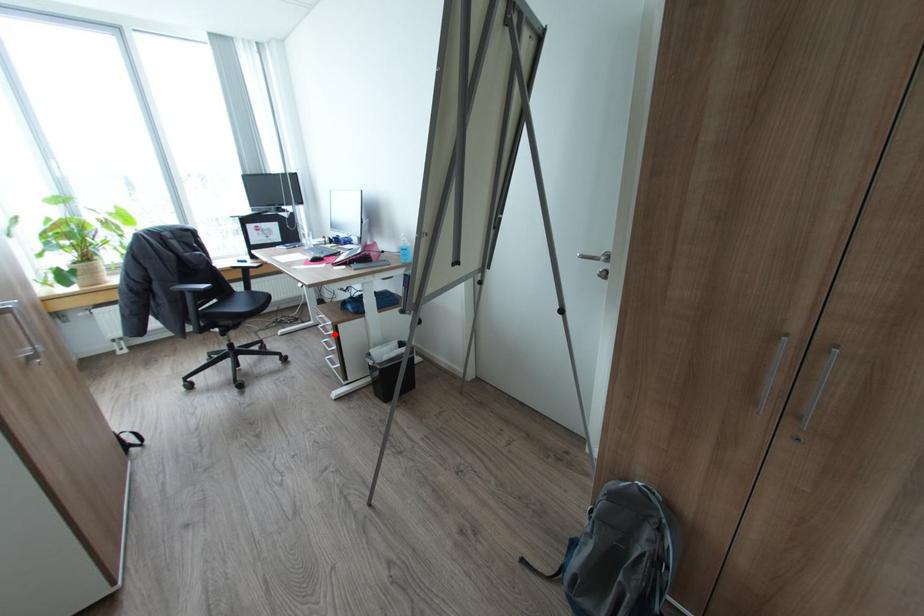
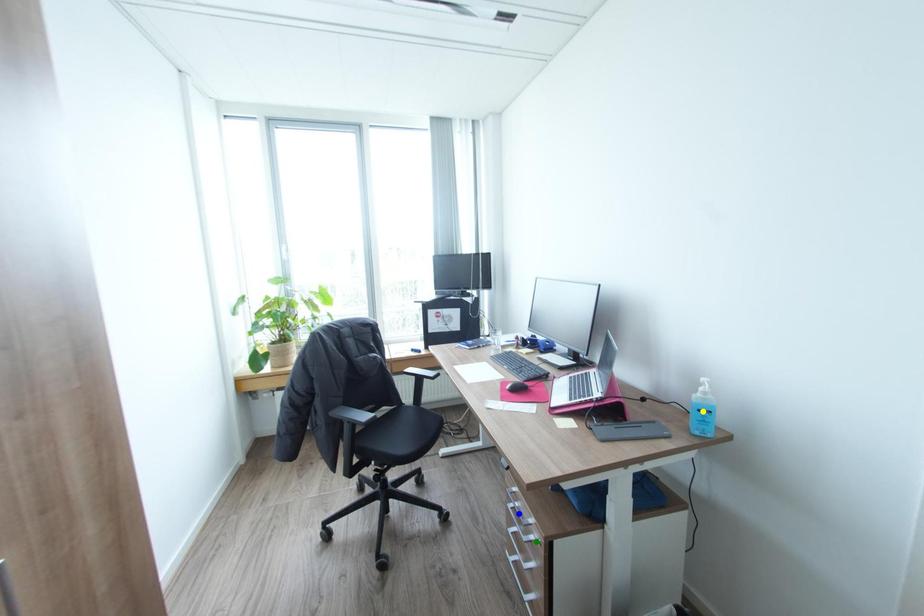
Question: I am providing you with two images of the same scene from different viewpoints. A red point is marked on the first image. You are given multiple points on the second image. Can you choose the point in image 2 that corresponds to the point in image 1?

Choices:
 (A) green point
 (B) blue point
 (C) yellow point

Answer: (A)